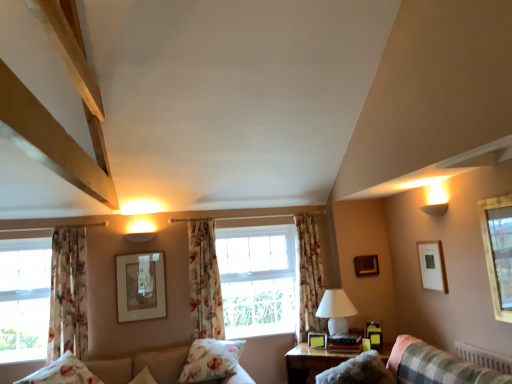
Question: From a real-world perspective, is floral fabric curtain at center, the 1th curtain from the right, positioned above or below matte gold picture frame at center, which is counted as the 2th picture frame, starting from the back?

Choices:
 (A) below
 (B) above

Answer: (A)

Question: Looking at the image, does floral fabric curtain at center, which is the third curtain from left to right, seem bigger or smaller compared to matte gold picture frame at center, the first picture frame viewed from the left?

Choices:
 (A) big
 (B) small

Answer: (A)

Question: Based on their relative distances, which object is farther from the floral fabric curtain at center, the 2th curtain in the left-to-right sequence?

Choices:
 (A) floral fabric curtain at left, the first curtain positioned from the left
 (B) floral fabric pillow at lower left, acting as the second pillow starting from the right
 (C) floral fabric pillow at center, the 2th pillow viewed from the left
 (D) fluffy plaid couch at lower right
 (E) matte gold picture frame at center, the fourth picture frame viewed from the front

Answer: (D)

Question: Estimate the real-world distances between objects in this image. Which object is farther from the floral fabric curtain at left, the 3th curtain positioned from the right?

Choices:
 (A) matte white picture frame at upper right, which appears as the fifth picture frame when viewed from the back
 (B) wooden table at lower center
 (C) floral fabric curtain at center, the 1th curtain from the right
 (D) floral fabric curtain at center, which ranks as the 2th curtain in right-to-left order
 (E) fluffy plaid couch at lower right

Answer: (A)